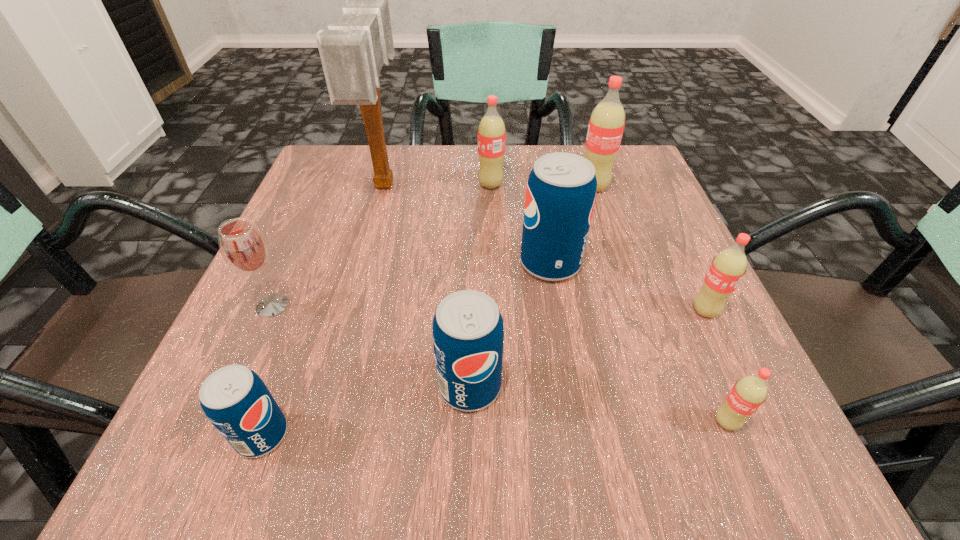
Locate an element on the screen. The image size is (960, 540). object at the far right corner is located at coordinates (606, 125).

Image resolution: width=960 pixels, height=540 pixels. Identify the location of object that is positioned at the near right corner. (750, 392).

The height and width of the screenshot is (540, 960). I want to click on vacant position at the far edge of the desktop, so click(432, 150).

Image resolution: width=960 pixels, height=540 pixels. In order to click on vacant point at the near edge in this screenshot , I will do `click(619, 416)`.

Image resolution: width=960 pixels, height=540 pixels. In the image, there is a desktop. What are the coordinates of `vacant area at the left edge` in the screenshot? It's located at (315, 204).

The image size is (960, 540). Find the location of `free space at the far left corner of the desktop`. free space at the far left corner of the desktop is located at coordinates (306, 195).

The image size is (960, 540). What are the coordinates of `vacant region at the near left corner of the desktop` in the screenshot? It's located at (212, 440).

What are the coordinates of `vacant space at the far right corner of the desktop` in the screenshot? It's located at (640, 159).

This screenshot has height=540, width=960. I want to click on vacant space in between the second biggest blue pop and the leftmost red soda, so click(x=480, y=285).

I want to click on vacant space in between the red wineglass and the smallest blue pop, so click(267, 370).